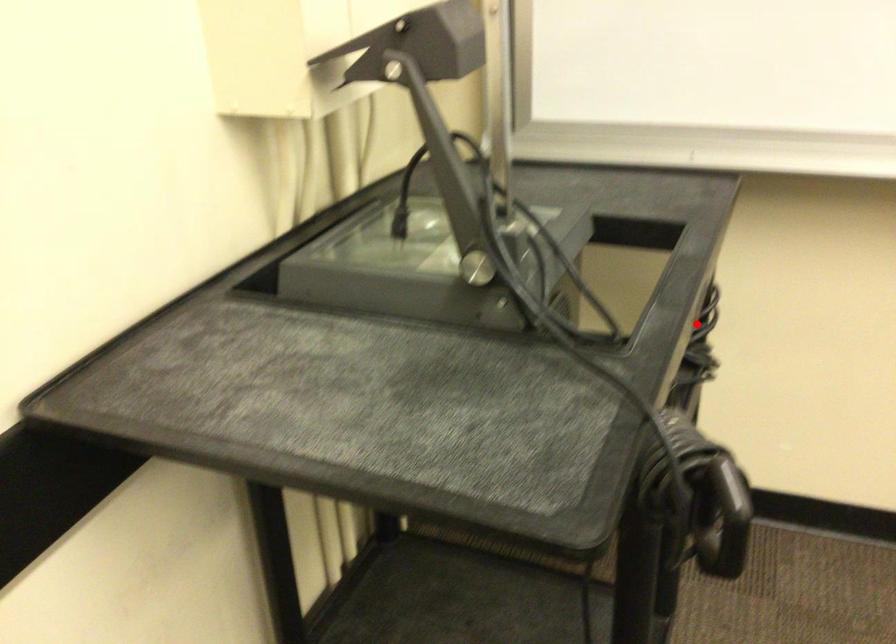
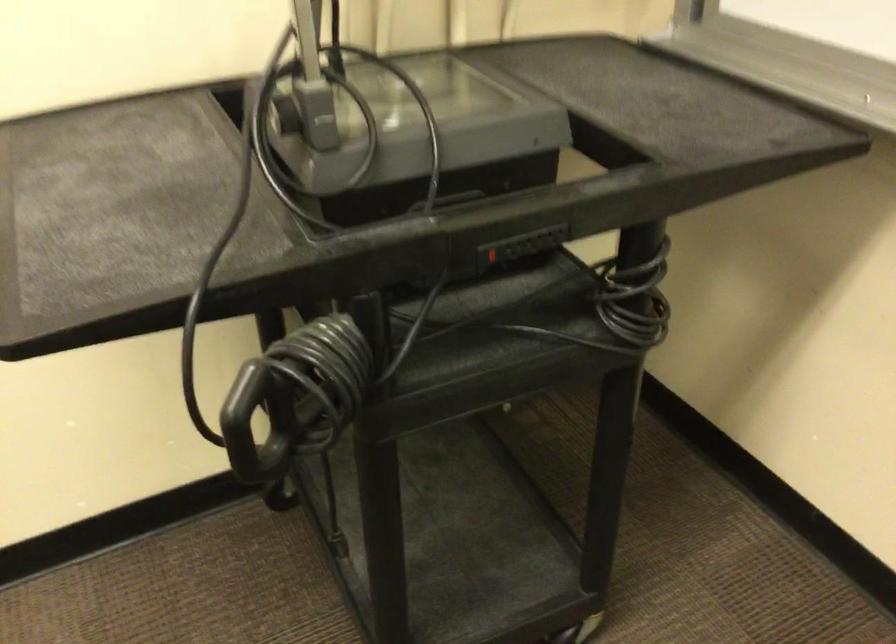
Question: I am providing you with two images of the same scene from different viewpoints. Given a red point in image1, look at the same physical point in image2. Is it:

Choices:
 (A) Closer to the viewpoint
 (B) Farther from the viewpoint

Answer: (A)